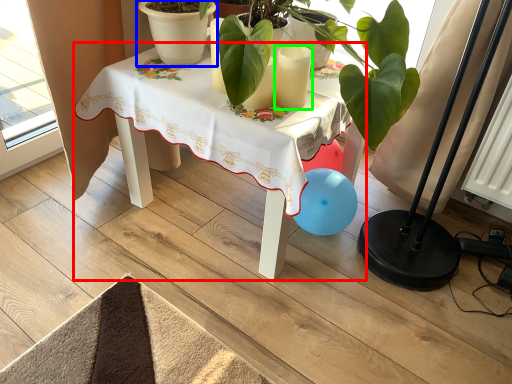
Question: Estimate the real-world distances between objects in this image. Which object is closer to table (highlighted by a red box), flowerpot (highlighted by a blue box) or candle (highlighted by a green box)?

Choices:
 (A) flowerpot
 (B) candle

Answer: (A)